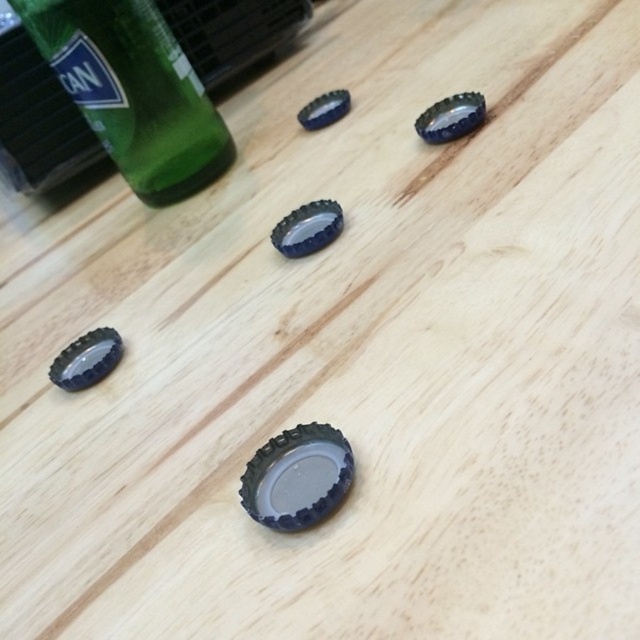
Is green matte glass bottle at upper left positioned in front of black rubber cap at center?

No, it is behind black rubber cap at center.

In the scene shown: Between green matte glass bottle at upper left and black rubber cap at center, which one has more height?

Standing taller between the two is green matte glass bottle at upper left.

Describe the element at coordinates (132, 92) in the screenshot. I see `green matte glass bottle at upper left` at that location.

Where is `green matte glass bottle at upper left`? green matte glass bottle at upper left is located at coordinates (132, 92).

Can you confirm if black rubber cap at center is positioned to the right of black rubber bottle cap at lower left?

Indeed, black rubber cap at center is positioned on the right side of black rubber bottle cap at lower left.

Does black rubber cap at center lie behind black rubber bottle cap at lower left?

No, it is not.

This screenshot has height=640, width=640. Find the location of `black rubber cap at center`. black rubber cap at center is located at coordinates (298, 477).

Can you confirm if green matte glass bottle at upper left is positioned to the left of black rubber bottle cap at lower left?

Yes, green matte glass bottle at upper left is to the left of black rubber bottle cap at lower left.

Which is in front, point (156, 104) or point (93, 362)?

Point (93, 362) is more forward.

Who is more distant from viewer, (93, 129) or (76, 378)?

The point (93, 129) is more distant.

Identify the location of green matte glass bottle at upper left. The height and width of the screenshot is (640, 640). (132, 92).